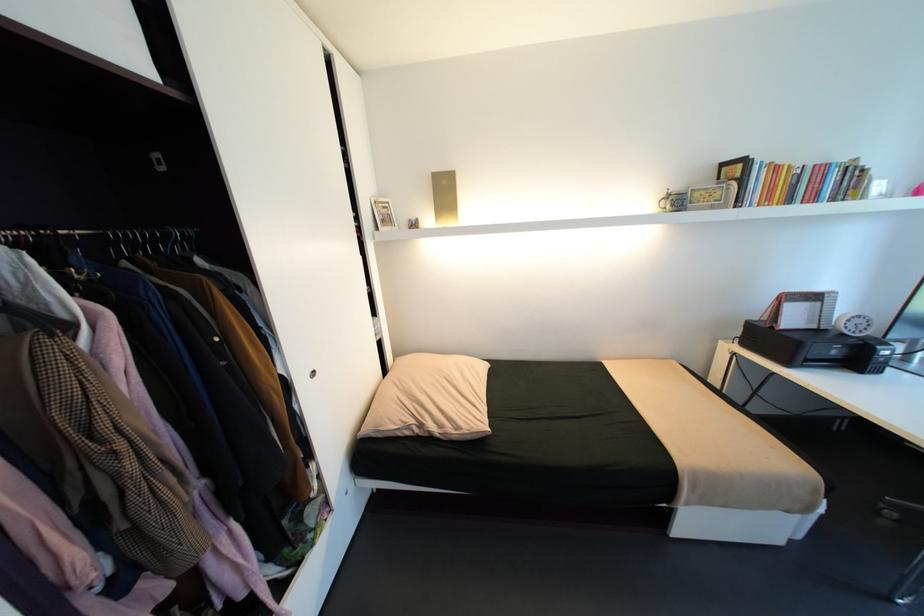
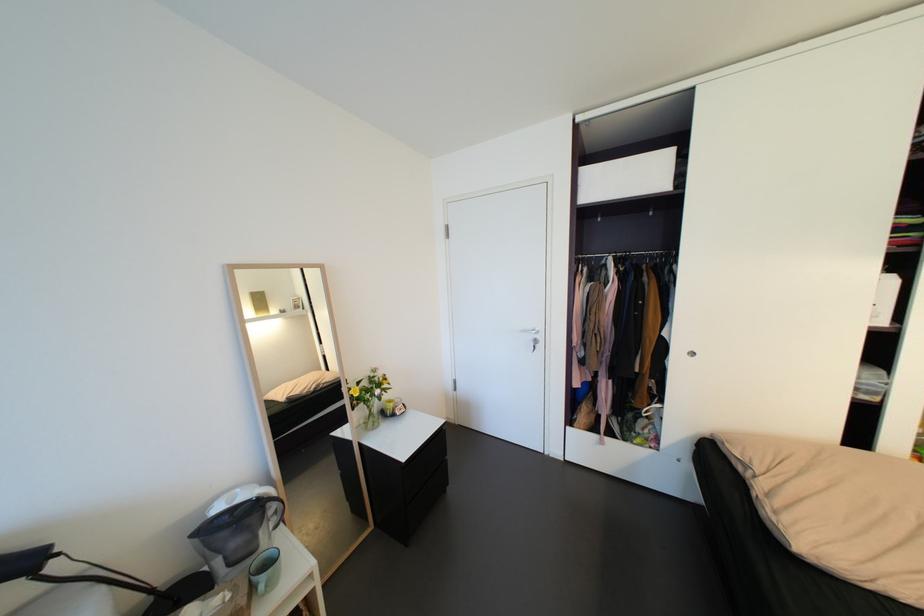
In the second image, find the point that corresponds to (x=163, y=249) in the first image.

(667, 261)